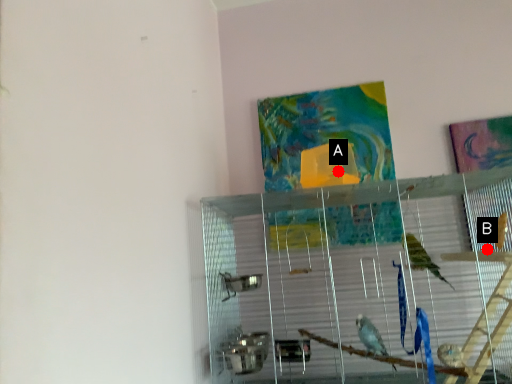
Question: Two points are circled on the image, labeled by A and B beside each circle. Which point appears closest to the camera in this image?

Choices:
 (A) A is closer
 (B) B is closer

Answer: (A)